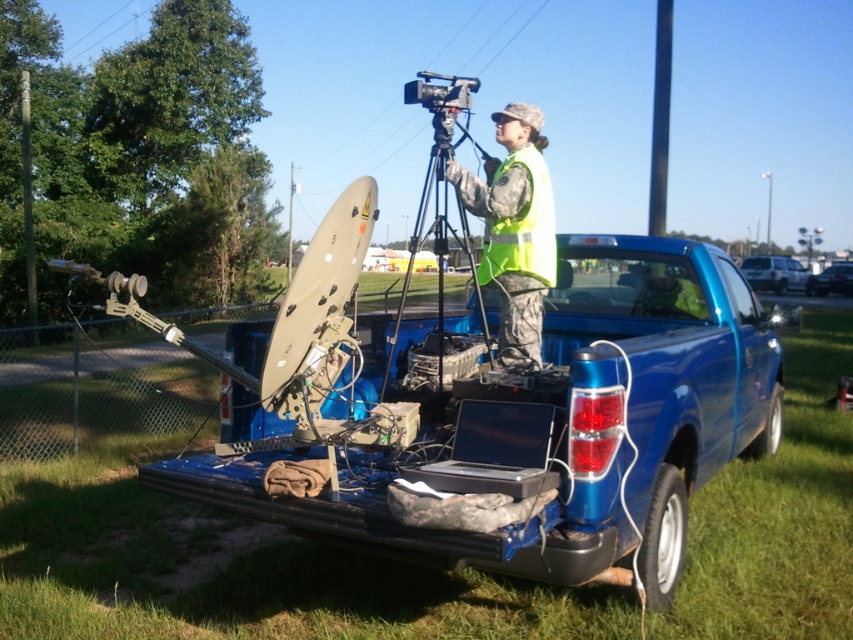
Is yellow reflective vest at center thinner than yellow reflective safety vest at center?

No, yellow reflective vest at center is not thinner than yellow reflective safety vest at center.

Where is `yellow reflective vest at center`? The width and height of the screenshot is (853, 640). yellow reflective vest at center is located at coordinates (514, 230).

Locate an element on the screen. Image resolution: width=853 pixels, height=640 pixels. yellow reflective vest at center is located at coordinates (514, 230).

Measure the distance between point (505, 252) and camera.

Point (505, 252) is 4.75 meters away from camera.

Which is more to the left, yellow reflective safety vest at center or metallic wire at upper center?

metallic wire at upper center

Measure the distance between point (529, 246) and camera.

They are 15.41 feet apart.

In order to click on yellow reflective safety vest at center in this screenshot , I will do `click(521, 227)`.

Between metallic tripod at center and metallic wire at upper center, which one is positioned higher?

metallic wire at upper center is above.

Is metallic tripod at center bigger than metallic wire at upper center?

Yes.

Is point (456, 118) positioned in front of point (80, 4)?

Yes, it is in front of point (80, 4).

Find the location of a particular element. metallic tripod at center is located at coordinates (434, 227).